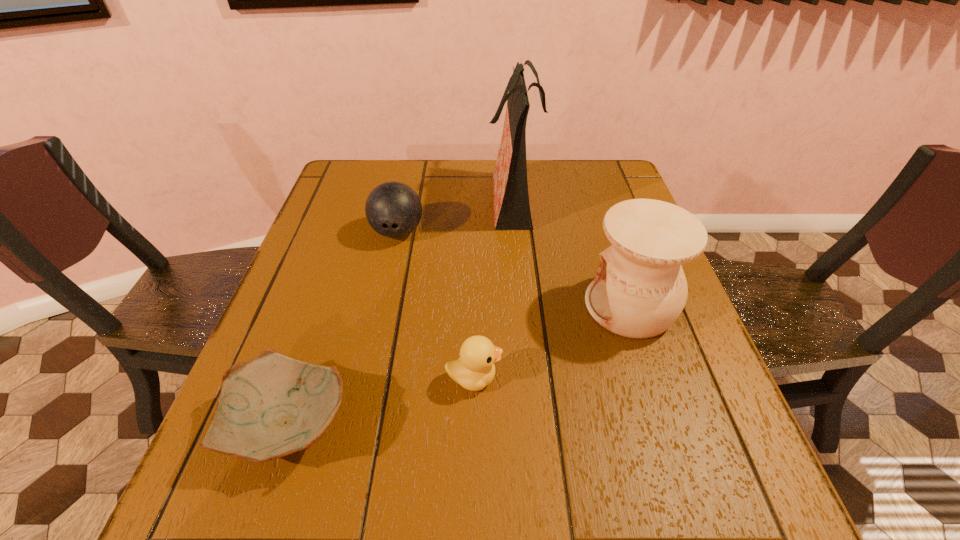
Where is `shopping bag`? The image size is (960, 540). shopping bag is located at coordinates (512, 211).

The width and height of the screenshot is (960, 540). Identify the location of the fourth shortest object. (640, 289).

Find the location of `the rightmost object`. the rightmost object is located at coordinates (640, 289).

Locate an element on the screen. Image resolution: width=960 pixels, height=540 pixels. the third tallest object is located at coordinates (393, 209).

Where is `duck`? duck is located at coordinates (475, 369).

Find the location of `the shortest object`. the shortest object is located at coordinates (271, 406).

Where is `the shorter pottery`? the shorter pottery is located at coordinates (271, 406).

At what (x,y) coordinates should I click in order to perform the action: click on free region located 0.350m on the front side of the tallest object. Please return your answer as a coordinate pair (x, y). The height and width of the screenshot is (540, 960). Looking at the image, I should click on (366, 197).

Identify the location of blank space located 0.280m on the front side of the tallest object. Image resolution: width=960 pixels, height=540 pixels. (390, 197).

Where is `vacant space located on the front side of the tallest object`? vacant space located on the front side of the tallest object is located at coordinates (348, 197).